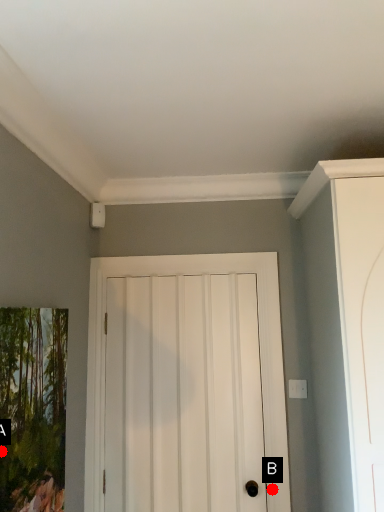
Question: Two points are circled on the image, labeled by A and B beside each circle. Which point appears farthest from the camera in this image?

Choices:
 (A) A is further
 (B) B is further

Answer: (B)